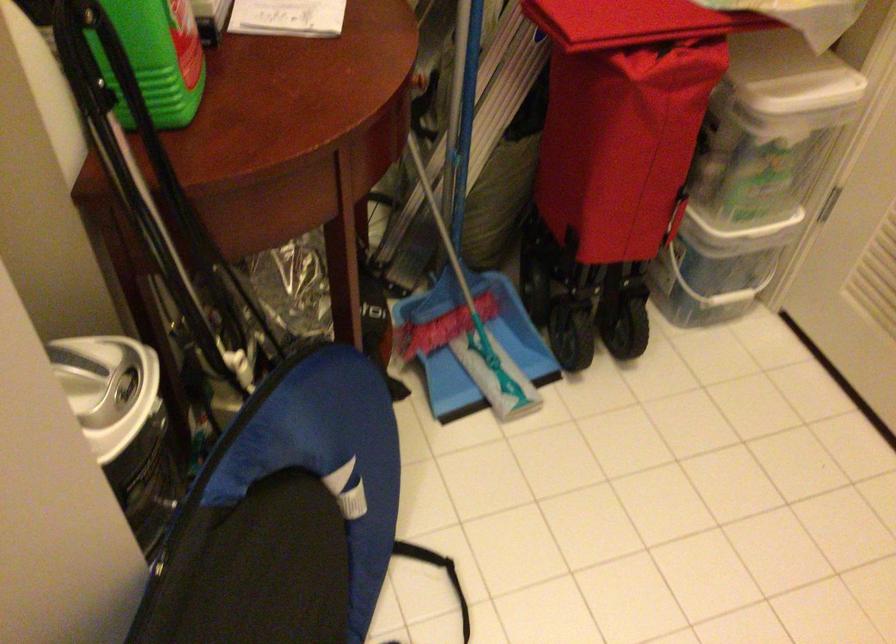
The height and width of the screenshot is (644, 896). Identify the location of clear bucket handle. (107, 388).